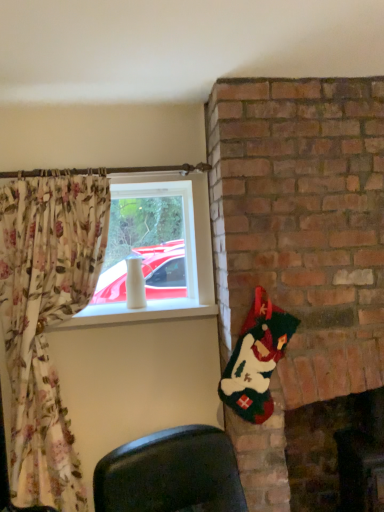
I want to click on white glossy vase at upper left, so click(x=185, y=257).

Describe the element at coordinates (185, 257) in the screenshot. I see `white glossy vase at upper left` at that location.

The width and height of the screenshot is (384, 512). What do you see at coordinates (336, 453) in the screenshot? I see `brick fireplace at lower right` at bounding box center [336, 453].

This screenshot has width=384, height=512. I want to click on brick fireplace at lower right, so click(336, 453).

You are a GUI agent. You are given a task and a screenshot of the screen. Output one action in this format:
    pyautogui.click(x=<x>, y=<y>)
    Task: Click on the white glossy vase at upper left
    The height and width of the screenshot is (512, 384).
    Given the screenshot: What is the action you would take?
    pyautogui.click(x=185, y=257)

Which is more to the right, white glossy vase at upper left or brick fireplace at lower right?

brick fireplace at lower right.

Which object is closer to the camera taking this photo, white glossy vase at upper left or brick fireplace at lower right?

brick fireplace at lower right.

Is point (198, 264) positioned after point (324, 475)?

No, (198, 264) is in front of (324, 475).

From the image's perspective, does white glossy vase at upper left appear lower than brick fireplace at lower right?

No, from the image's perspective, white glossy vase at upper left is not beneath brick fireplace at lower right.

From a real-world perspective, is white glossy vase at upper left on brick fireplace at lower right?

Yes, from a real-world perspective, white glossy vase at upper left is over brick fireplace at lower right

Can you confirm if white glossy vase at upper left is thinner than brick fireplace at lower right?

Correct, the width of white glossy vase at upper left is less than that of brick fireplace at lower right.

Is white glossy vase at upper left shorter than brick fireplace at lower right?

Yes.

Who is smaller, white glossy vase at upper left or brick fireplace at lower right?

With smaller size is white glossy vase at upper left.

Is white glossy vase at upper left outside of brick fireplace at lower right?

Indeed, white glossy vase at upper left is completely outside brick fireplace at lower right.

Is the surface of white glossy vase at upper left in direct contact with brick fireplace at lower right?

No, white glossy vase at upper left is not in contact with brick fireplace at lower right.

Is white glossy vase at upper left positioned with its back to brick fireplace at lower right?

No, brick fireplace at lower right is not at the back of white glossy vase at upper left.

Where is `window above the brick fireplace at lower right (from a real-world perspective)`? This screenshot has height=512, width=384. window above the brick fireplace at lower right (from a real-world perspective) is located at coordinates (185, 257).

Which is more to the left, brick fireplace at lower right or white glossy vase at upper left?

white glossy vase at upper left is more to the left.

In the scene shown: Does brick fireplace at lower right come behind white glossy vase at upper left?

No, it is not.

Is point (355, 477) closer or farther from the camera than point (201, 185)?

Point (355, 477) is farther from the camera than point (201, 185).

From the image's perspective, is brick fireplace at lower right on top of white glossy vase at upper left?

No, from the image's perspective, brick fireplace at lower right is not over white glossy vase at upper left.

From a real-world perspective, is brick fireplace at lower right below white glossy vase at upper left?

Yes, from a real-world perspective, brick fireplace at lower right is below white glossy vase at upper left.

Considering the sizes of objects brick fireplace at lower right and white glossy vase at upper left in the image provided, who is thinner, brick fireplace at lower right or white glossy vase at upper left?

With smaller width is white glossy vase at upper left.

Is brick fireplace at lower right shorter than white glossy vase at upper left?

Incorrect, the height of brick fireplace at lower right does not fall short of that of white glossy vase at upper left.

Is brick fireplace at lower right bigger than white glossy vase at upper left?

Correct, brick fireplace at lower right is larger in size than white glossy vase at upper left.

Is brick fireplace at lower right not inside white glossy vase at upper left?

Yes.

Are brick fireplace at lower right and white glossy vase at upper left making contact?

No.

Could you tell me if brick fireplace at lower right is facing white glossy vase at upper left?

No, brick fireplace at lower right is not oriented towards white glossy vase at upper left.

What's the angular difference between brick fireplace at lower right and white glossy vase at upper left's facing directions?

1.44 degrees separate the facing orientations of brick fireplace at lower right and white glossy vase at upper left.

Locate an element on the screen. This screenshot has height=512, width=384. window that is above the brick fireplace at lower right (from a real-world perspective) is located at coordinates (185, 257).

Find the location of a particular element. This screenshot has height=512, width=384. fireplace on the right side of white glossy vase at upper left is located at coordinates (336, 453).

This screenshot has height=512, width=384. I want to click on fireplace below the white glossy vase at upper left (from a real-world perspective), so click(336, 453).